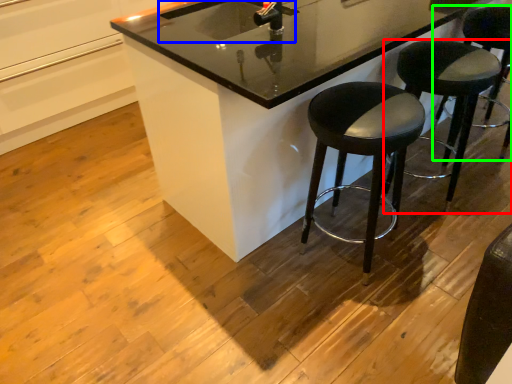
Question: Estimate the real-world distances between objects in this image. Which object is farther from stool (highlighted by a red box), sink (highlighted by a blue box) or stool (highlighted by a green box)?

Choices:
 (A) sink
 (B) stool

Answer: (A)